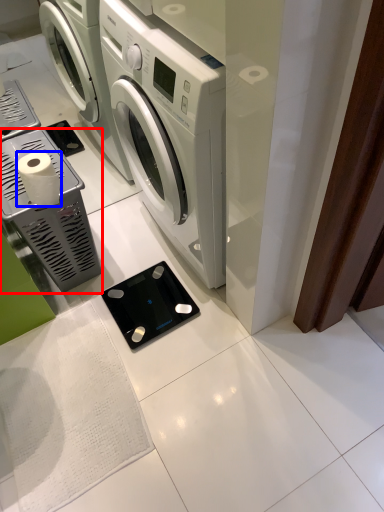
Question: Which point is further to the camera, appliance (highlighted by a red box) or toilet paper (highlighted by a blue box)?

Choices:
 (A) appliance
 (B) toilet paper

Answer: (A)